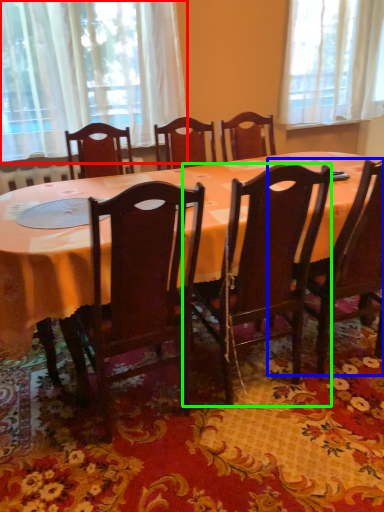
Question: Considering the real-world distances, which object is farthest from curtain (highlighted by a red box)? chair (highlighted by a blue box) or chair (highlighted by a green box)?

Choices:
 (A) chair
 (B) chair

Answer: (A)